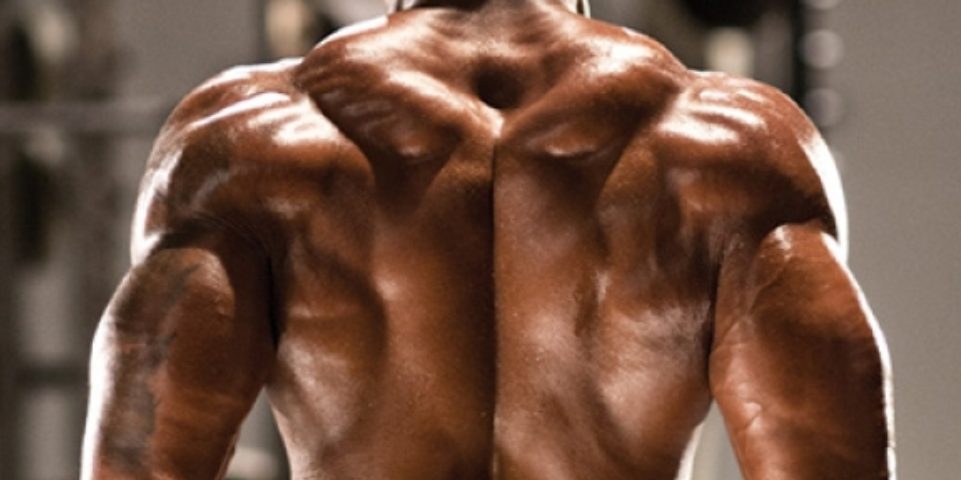
Image resolution: width=961 pixels, height=480 pixels. What are the coordinates of `wall` in the screenshot? It's located at (903, 87), (898, 157), (898, 271), (864, 145), (952, 143).